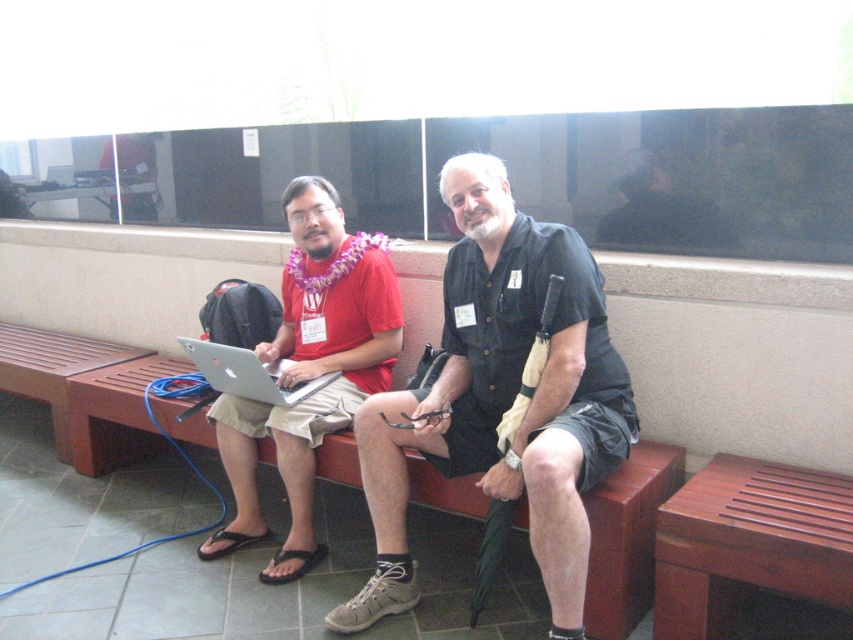
Does matte black shirt at center have a smaller size compared to brown wooden bench at center?

Actually, matte black shirt at center might be larger than brown wooden bench at center.

Who is lower down, matte black shirt at center or brown wooden bench at center?

brown wooden bench at center is below.

Image resolution: width=853 pixels, height=640 pixels. What do you see at coordinates (502, 397) in the screenshot?
I see `matte black shirt at center` at bounding box center [502, 397].

Where is `matte black shirt at center`? matte black shirt at center is located at coordinates (502, 397).

Is point (503, 394) more distant than point (7, 333)?

That is False.

Is matte black shirt at center further to camera compared to brown wooden bench at lower left?

No, matte black shirt at center is in front of brown wooden bench at lower left.

Does point (373, 524) come behind point (15, 337)?

No, it is not.

The image size is (853, 640). I want to click on matte black shirt at center, so click(502, 397).

Is point (347, 410) farther from viewer compared to point (22, 364)?

No, (347, 410) is closer to viewer.

Can you confirm if matte black laptop at left is positioned to the left of brown wooden bench at lower left?

In fact, matte black laptop at left is to the right of brown wooden bench at lower left.

Who is more distant from viewer, (343,234) or (42,360)?

Point (42,360)

At what (x,y) coordinates should I click in order to perform the action: click on matte black laptop at left. Please return your answer as a coordinate pair (x, y). The image size is (853, 640). Looking at the image, I should click on (309, 371).